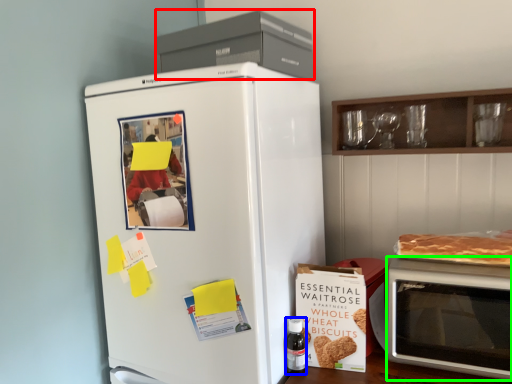
Question: Estimate the real-world distances between objects in this image. Which object is closer to appliance (highlighted by a red box), bottle (highlighted by a blue box) or microwave oven (highlighted by a green box)?

Choices:
 (A) bottle
 (B) microwave oven

Answer: (B)